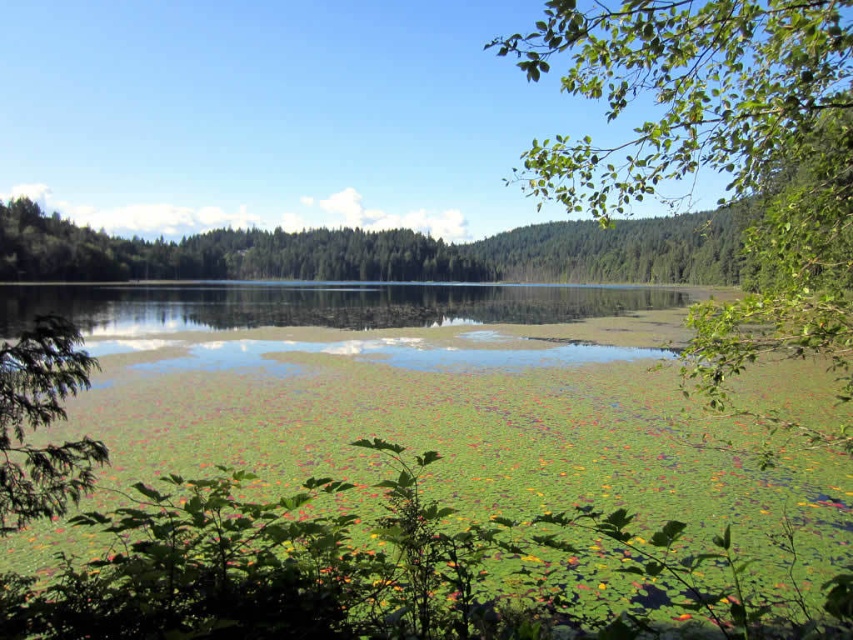
Can you confirm if green leafy branch at upper right is bigger than green leafy tree at left?

Correct, green leafy branch at upper right is larger in size than green leafy tree at left.

Is green leafy branch at upper right shorter than green leafy tree at left?

In fact, green leafy branch at upper right may be taller than green leafy tree at left.

Which is in front, point (813, 289) or point (45, 369)?

Point (45, 369) is more forward.

At what (x,y) coordinates should I click in order to perform the action: click on green leafy branch at upper right. Please return your answer as a coordinate pair (x, y). The image size is (853, 640). Looking at the image, I should click on (720, 152).